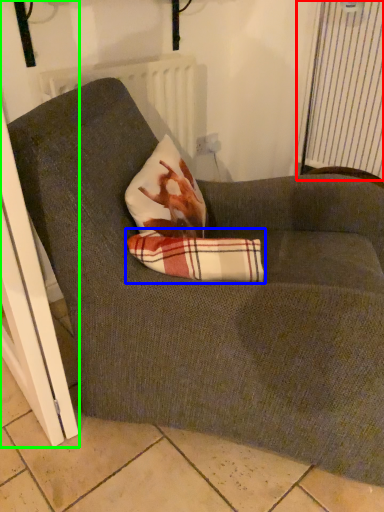
Question: Which object is the farthest from curtain (highlighted by a red box)? Choose among these: plaid (highlighted by a blue box) or screen door (highlighted by a green box).

Choices:
 (A) plaid
 (B) screen door

Answer: (B)